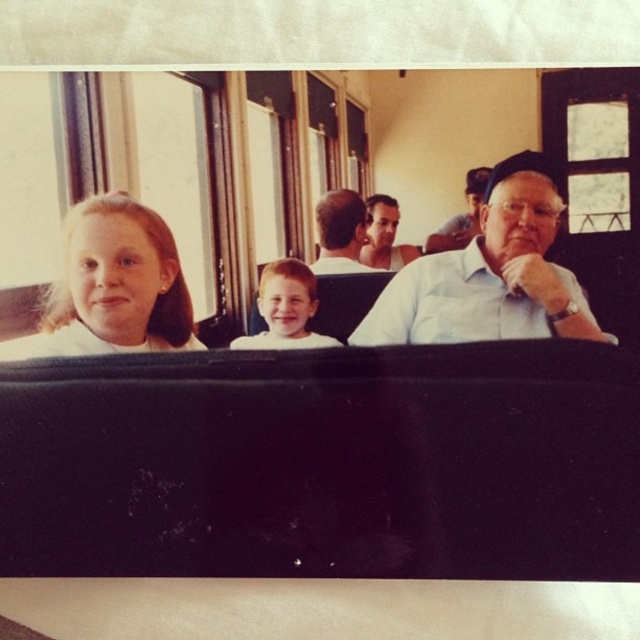
You are a photographer trying to capture a candid shot of the passengers in the train car. You notice the blonde hair at left and the smooth white tank top at center. Which of these two items would require a wider aperture setting to ensure they are in focus, considering their sizes in the frame?

The blonde hair at left is wider than the smooth white tank top at center, so it would require a wider aperture to ensure it is in focus due to its larger size in the frame.

From the picture: You are a photographer taking a picture of the light blue shirt at center and the smooth blonde hair at center in the train car scene. Based on their positions, which object should you focus on first if you want to capture both in a single frame without moving the camera?

The smooth blonde hair at center should be focused on first since the light blue shirt at center is positioned to its right, meaning they are adjacent and can be captured together in one frame by centering the smooth blonde hair first.

You are a passenger on this train and want to find the person wearing the light blue shirt at center. Which direction should you look relative to the smooth blonde hair at center?

The light blue shirt at center is located above the smooth blonde hair at center, so you should look upwards from the smooth blonde hair at center to find the light blue shirt at center.